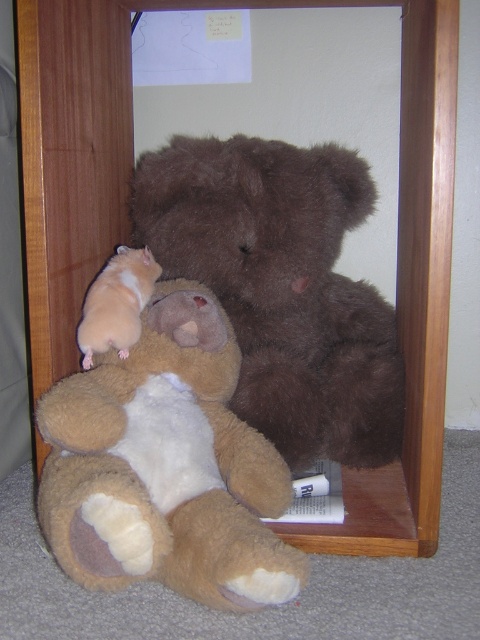
Between point (156, 548) and point (109, 316), which one is positioned in front?

Point (156, 548)

Identify the location of light brown plush hamster at lower left. (166, 467).

Can you confirm if light brown plush hamster at lower left is positioned to the left of brown plush teddy bear at center?

Indeed, light brown plush hamster at lower left is positioned on the left side of brown plush teddy bear at center.

Does light brown plush hamster at lower left appear under brown plush teddy bear at center?

Correct, light brown plush hamster at lower left is located below brown plush teddy bear at center.

Identify the location of light brown plush hamster at lower left. This screenshot has width=480, height=640. (166, 467).

Does brown plush teddy bear at center appear on the left side of light brown fur hamster at left?

In fact, brown plush teddy bear at center is to the right of light brown fur hamster at left.

This screenshot has width=480, height=640. Describe the element at coordinates (282, 285) in the screenshot. I see `brown plush teddy bear at center` at that location.

You are a GUI agent. You are given a task and a screenshot of the screen. Output one action in this format:
    pyautogui.click(x=<x>, y=<y>)
    Task: Click on the brown plush teddy bear at center
    The image size is (480, 640).
    Given the screenshot: What is the action you would take?
    pyautogui.click(x=282, y=285)